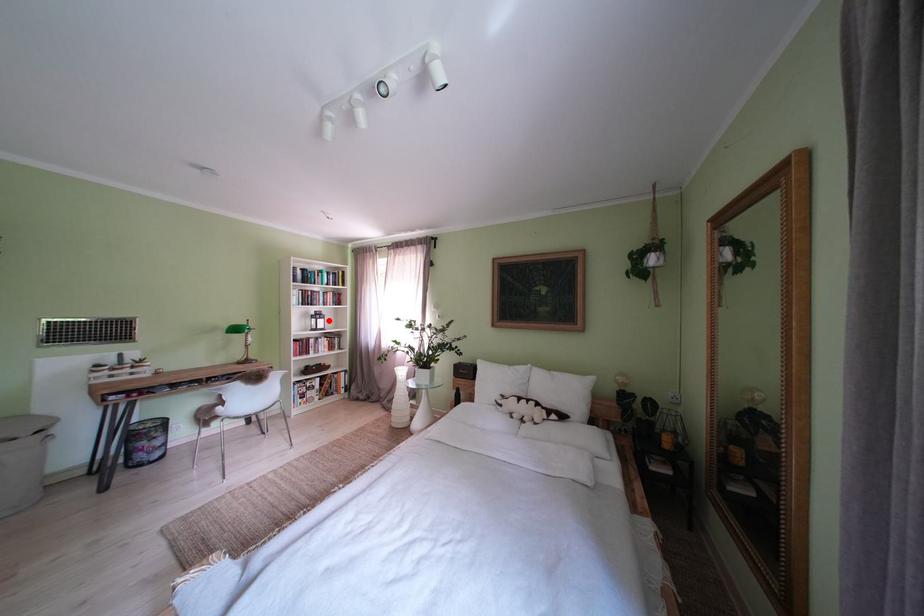
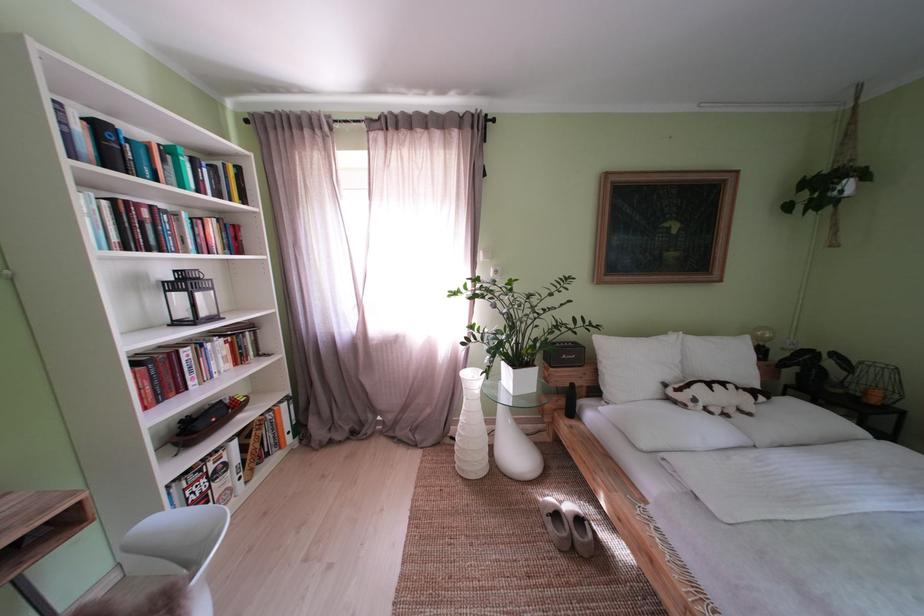
The point at the highlighted location is marked in the first image. Where is the corresponding point in the second image?

(198, 286)